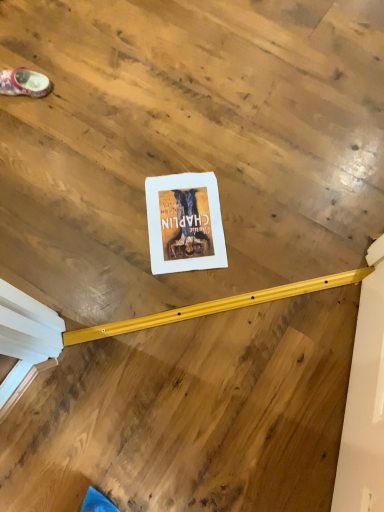
What are the coordinates of `matte pink fabric slipper at upper left` in the screenshot? It's located at (24, 83).

The width and height of the screenshot is (384, 512). Describe the element at coordinates (24, 83) in the screenshot. I see `matte pink fabric slipper at upper left` at that location.

At what (x,y) coordinates should I click in order to perform the action: click on white paper at center. Please return your answer as a coordinate pair (x, y). This screenshot has width=384, height=512. Looking at the image, I should click on (184, 223).

Describe the element at coordinates (184, 223) in the screenshot. This screenshot has width=384, height=512. I see `white paper at center` at that location.

Locate an element on the screen. The image size is (384, 512). matte pink fabric slipper at upper left is located at coordinates (24, 83).

Based on the photo, considering the positions of objects white paper at center and matte pink fabric slipper at upper left in the image provided, who is more to the right, white paper at center or matte pink fabric slipper at upper left?

white paper at center is more to the right.

Does white paper at center lie in front of matte pink fabric slipper at upper left?

Yes, white paper at center is closer to the viewer.

Considering the positions of point (151, 193) and point (33, 91), is point (151, 193) closer or farther from the camera than point (33, 91)?

Point (151, 193) appears to be closer to the viewer than point (33, 91).

From the image's perspective, is white paper at center located above or below matte pink fabric slipper at upper left?

Based on their image positions, white paper at center is located beneath matte pink fabric slipper at upper left.

From a real-world perspective, is white paper at center beneath matte pink fabric slipper at upper left?

Yes, from a real-world perspective, white paper at center is below matte pink fabric slipper at upper left.

Which of these two, white paper at center or matte pink fabric slipper at upper left, is thinner?

matte pink fabric slipper at upper left is thinner.

Based on the photo, considering the sizes of white paper at center and matte pink fabric slipper at upper left in the image, is white paper at center taller or shorter than matte pink fabric slipper at upper left?

white paper at center is shorter than matte pink fabric slipper at upper left.

Looking at the image, does white paper at center seem bigger or smaller compared to matte pink fabric slipper at upper left?

white paper at center is smaller than matte pink fabric slipper at upper left.

Is white paper at center inside or outside of matte pink fabric slipper at upper left?

white paper at center cannot be found inside matte pink fabric slipper at upper left.

Based on the photo, is white paper at center in contact with matte pink fabric slipper at upper left?

No, white paper at center is not making contact with matte pink fabric slipper at upper left.

Is white paper at center facing away from matte pink fabric slipper at upper left?

No, white paper at center is not facing away from matte pink fabric slipper at upper left.

How different are the orientations of white paper at center and matte pink fabric slipper at upper left in degrees?

They differ by 15 degrees in their facing directions.

In order to click on poster page below the matte pink fabric slipper at upper left (from the image's perspective) in this screenshot , I will do `click(184, 223)`.

Looking at this image, which is more to the right, matte pink fabric slipper at upper left or white paper at center?

white paper at center.

Looking at this image, is the depth of matte pink fabric slipper at upper left greater than that of white paper at center?

That is True.

Does point (41, 84) come closer to viewer compared to point (180, 195)?

No.

From the image's perspective, which object appears higher, matte pink fabric slipper at upper left or white paper at center?

From the image's view, matte pink fabric slipper at upper left is above.

Looking at this image, from a real-world perspective, is matte pink fabric slipper at upper left physically below white paper at center?

No, from a real-world perspective, matte pink fabric slipper at upper left is not below white paper at center.

Which of these two, matte pink fabric slipper at upper left or white paper at center, is wider?

Wider between the two is white paper at center.

Consider the image. Does matte pink fabric slipper at upper left have a lesser height compared to white paper at center?

Incorrect, the height of matte pink fabric slipper at upper left does not fall short of that of white paper at center.

Can you confirm if matte pink fabric slipper at upper left is bigger than white paper at center?

Correct, matte pink fabric slipper at upper left is larger in size than white paper at center.

Could white paper at center be considered to be inside matte pink fabric slipper at upper left?

Actually, white paper at center is outside matte pink fabric slipper at upper left.

Is matte pink fabric slipper at upper left far away from white paper at center?

matte pink fabric slipper at upper left is actually quite close to white paper at center.

Is matte pink fabric slipper at upper left looking in the opposite direction of white paper at center?

No, matte pink fabric slipper at upper left's orientation is not away from white paper at center.

Find the location of `poster page on the right of matte pink fabric slipper at upper left`. poster page on the right of matte pink fabric slipper at upper left is located at coordinates (184, 223).

Image resolution: width=384 pixels, height=512 pixels. I want to click on footwear above the white paper at center (from the image's perspective), so click(x=24, y=83).

The width and height of the screenshot is (384, 512). Identify the location of footwear on the left of white paper at center. (24, 83).